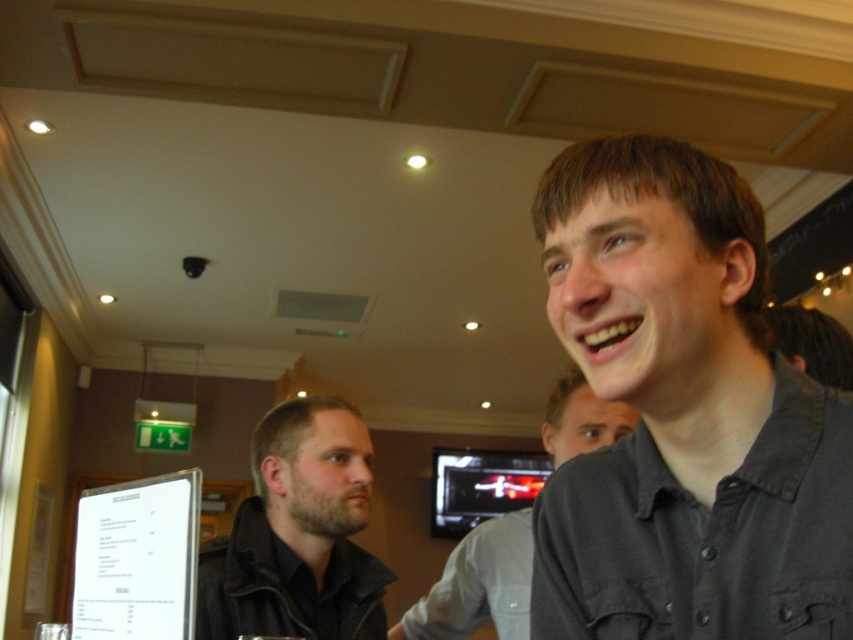
You are a photographer setting up a shot in this scene. You need to ensure that the dark gray shirt at upper right and the dark brown leather jacket at center are both in focus. Given their sizes, which object might require you to adjust your camera settings to account for its smaller size?

The dark gray shirt at upper right has a lesser width compared to the dark brown leather jacket at center, so you should adjust your camera settings to focus on the smaller dark gray shirt at upper right to ensure it appears sharp in the photo.

You are a photographer standing at the entrance of the dining area. You want to take a photo of both the dark gray shirt at upper right and the dark brown leather jacket at center. Can you fit both subjects into your camera frame if your camera has a maximum width of 60 centimeters?

The dark gray shirt at upper right and dark brown leather jacket at center are 57.98 centimeters apart, so yes, both subjects can fit into the camera frame since the distance between them is less than the camera width of 60 centimeters.

What is the exact coordinate of the dark gray shirt at upper right?

The dark gray shirt at upper right is located at coordinate point (683, 416).